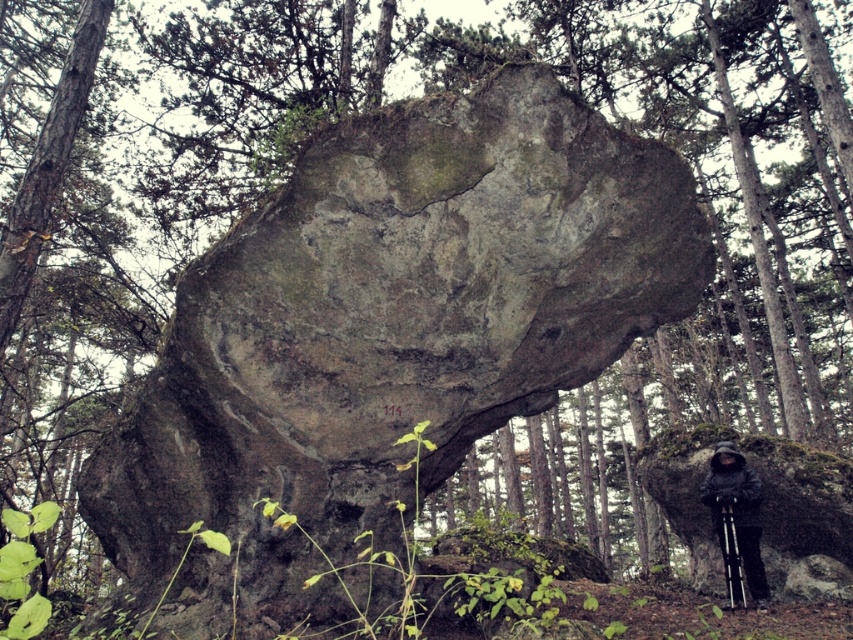
You are standing in a forest and see the gray rough rock at center. If you want to place a 10 feet long ladder horizontally on the ground between you and the rock, will it fit?

The distance between you and the gray rough rock at center is 14.65 feet. Since the ladder is 10 feet long, it will fit comfortably within the space available.